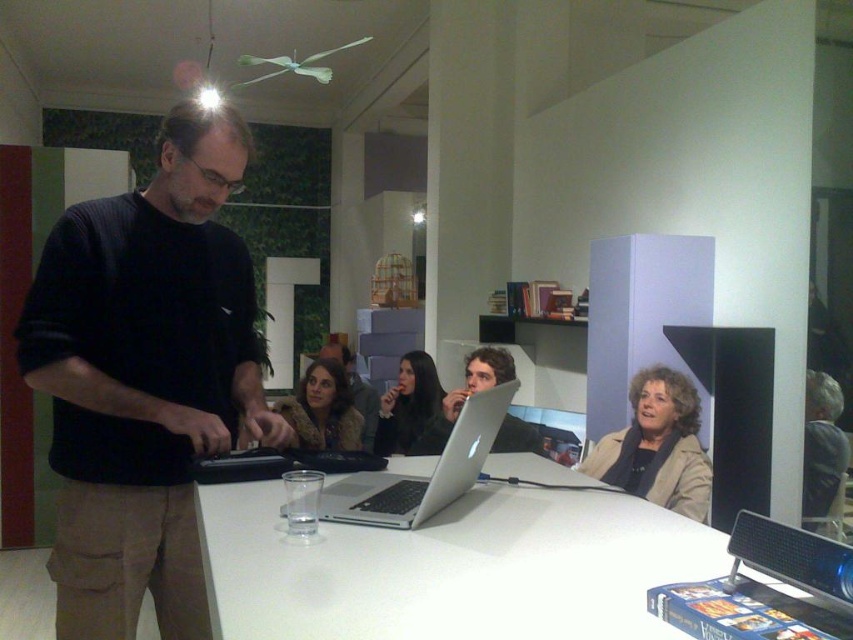
You are sitting in a chair facing the black matte shirt at center and the white glossy table at center. Which object is closer to you?

The black matte shirt at center is closer to you because it is further to the viewer than the white glossy table at center, meaning it appears nearer in the visual perspective.

You are a photographer trying to capture a candid shot of the black matte shirt at center and the matte black jacket at center. Since both are in the center, which one is more to the right?

The black matte shirt at center is positioned on the right side of matte black jacket at center, so the black matte shirt at center is more to the right.

You are a tailor observing the black matte shirt at center and the matte black jacket at center. Which one is taller?

The black matte shirt at center is taller than the matte black jacket at center.